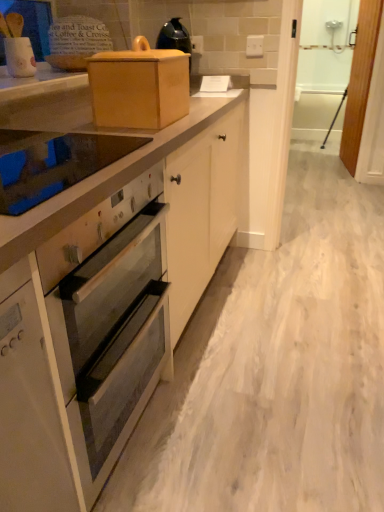
What is the approximate height of glass smooth cooktop at upper left?

glass smooth cooktop at upper left is 1.31 inches in height.

This screenshot has height=512, width=384. In order to click on wooden box at upper center in this screenshot , I will do `click(139, 87)`.

Could you tell me if wooden box at upper center is facing white glossy oven at center?

No, wooden box at upper center is not turned towards white glossy oven at center.

Which object is more forward, wooden box at upper center or white glossy oven at center?

Positioned in front is white glossy oven at center.

Is wooden box at upper center far from white glossy oven at center?

wooden box at upper center is near white glossy oven at center, not far away.

How far apart are wooden box at upper center and white wood screen door at right, marked as the 2th screen door in a right-to-left arrangement?

wooden box at upper center is 4.26 meters from white wood screen door at right, marked as the 2th screen door in a right-to-left arrangement.

Which of these two, wooden box at upper center or white wood screen door at right, which ranks as the 1th screen door in left-to-right order, is smaller?

Smaller between the two is wooden box at upper center.

Is wooden box at upper center positioned with its back to white wood screen door at right, which ranks as the 1th screen door in left-to-right order?

Result: No.

Is point (139, 76) closer to camera compared to point (326, 14)?

Yes, it is.

Considering the points (349, 91) and (100, 92), which point is behind, point (349, 91) or point (100, 92)?

Positioned behind is point (349, 91).

Is wooden box at upper center at the back of wooden screen door at right, the first screen door viewed from the right?

No, wooden screen door at right, the first screen door viewed from the right, is not facing away from wooden box at upper center.

Which of these two, wooden screen door at right, the first screen door viewed from the right, or wooden box at upper center, is wider?

Wider between the two is wooden box at upper center.

Is wooden screen door at right, marked as the second screen door in a left-to-right arrangement, inside or outside of white wood screen door at right, which ranks as the 1th screen door in left-to-right order?

wooden screen door at right, marked as the second screen door in a left-to-right arrangement, lies outside white wood screen door at right, which ranks as the 1th screen door in left-to-right order.

From the image's perspective, is wooden screen door at right, marked as the second screen door in a left-to-right arrangement, above or below white wood screen door at right, which ranks as the 1th screen door in left-to-right order?

wooden screen door at right, marked as the second screen door in a left-to-right arrangement, is situated higher than white wood screen door at right, which ranks as the 1th screen door in left-to-right order, in the image.

Based on the photo, does wooden screen door at right, marked as the second screen door in a left-to-right arrangement, lie in front of white wood screen door at right, marked as the 2th screen door in a right-to-left arrangement?

No, wooden screen door at right, marked as the second screen door in a left-to-right arrangement, is behind white wood screen door at right, marked as the 2th screen door in a right-to-left arrangement.

From a real-world perspective, does white wood screen door at right, marked as the 2th screen door in a right-to-left arrangement, sit lower than white glossy oven at center?

No.

Is white wood screen door at right, which ranks as the 1th screen door in left-to-right order, positioned far away from white glossy oven at center?

Yes.

Considering the positions of points (308, 67) and (121, 437), is point (308, 67) farther from camera compared to point (121, 437)?

That is True.

Does white wood screen door at right, which ranks as the 1th screen door in left-to-right order, turn towards white glossy oven at center?

Yes.

From the image's perspective, is wooden screen door at right, marked as the second screen door in a left-to-right arrangement, beneath glass smooth cooktop at upper left?

No, from the image's perspective, wooden screen door at right, marked as the second screen door in a left-to-right arrangement, is not beneath glass smooth cooktop at upper left.

Does point (348, 163) come closer to viewer compared to point (47, 147)?

No, it is not.

From a real-world perspective, who is located lower, wooden screen door at right, the first screen door viewed from the right, or glass smooth cooktop at upper left?

wooden screen door at right, the first screen door viewed from the right, is physically lower.

Which is closer to the camera, (156,100) or (18,154)?

Positioned in front is point (18,154).

Is wooden box at upper center beside glass smooth cooktop at upper left?

No, wooden box at upper center is not touching glass smooth cooktop at upper left.

Between wooden box at upper center and glass smooth cooktop at upper left, which one appears on the right side from the viewer's perspective?

Positioned to the right is wooden box at upper center.

Which is correct: wooden box at upper center is inside glass smooth cooktop at upper left, or outside of it?

wooden box at upper center lies outside glass smooth cooktop at upper left.

At what (x,y) coordinates should I click in order to perform the action: click on appliance that appears above the white glossy oven at center (from a real-world perspective). Please return your answer as a coordinate pair (x, y). Looking at the image, I should click on (139, 87).

From the image's perspective, count 1st screen doors upward from the wooden box at upper center and point to it. Please provide its 2D coordinates.

[(322, 64)]

From the image, which object appears to be nearer to glass smooth cooktop at upper left, wooden screen door at right, the first screen door viewed from the right, or white glossy oven at center?

white glossy oven at center lies closer to glass smooth cooktop at upper left than the other object.

Looking at the image, which one is located further to white glossy oven at center, white wood screen door at right, which ranks as the 1th screen door in left-to-right order, or wooden box at upper center?

white wood screen door at right, which ranks as the 1th screen door in left-to-right order, lies further to white glossy oven at center than the other object.

Which object lies nearer to the anchor point white wood screen door at right, marked as the 2th screen door in a right-to-left arrangement, wooden box at upper center or white glossy oven at center?

The object closer to white wood screen door at right, marked as the 2th screen door in a right-to-left arrangement, is wooden box at upper center.

When comparing their distances from glass smooth cooktop at upper left, does white wood screen door at right, marked as the 2th screen door in a right-to-left arrangement, or white glossy oven at center seem closer?

white glossy oven at center is positioned closer to the anchor glass smooth cooktop at upper left.

Which object lies nearer to the anchor point white wood screen door at right, marked as the 2th screen door in a right-to-left arrangement, wooden screen door at right, marked as the second screen door in a left-to-right arrangement, or wooden box at upper center?

wooden screen door at right, marked as the second screen door in a left-to-right arrangement, is closer to white wood screen door at right, marked as the 2th screen door in a right-to-left arrangement.

Estimate the real-world distances between objects in this image. Which object is closer to wooden screen door at right, the first screen door viewed from the right, wooden box at upper center or white wood screen door at right, marked as the 2th screen door in a right-to-left arrangement?

Among the two, white wood screen door at right, marked as the 2th screen door in a right-to-left arrangement, is located nearer to wooden screen door at right, the first screen door viewed from the right.

Looking at this image, which object lies further to the anchor point white wood screen door at right, marked as the 2th screen door in a right-to-left arrangement, wooden box at upper center or glass smooth cooktop at upper left?

glass smooth cooktop at upper left is positioned further to the anchor white wood screen door at right, marked as the 2th screen door in a right-to-left arrangement.

In the scene shown: Based on their spatial positions, is white glossy oven at center or wooden box at upper center closer to wooden screen door at right, the first screen door viewed from the right?

Among the two, wooden box at upper center is located nearer to wooden screen door at right, the first screen door viewed from the right.

Find the location of a particular element. This screenshot has width=384, height=512. appliance located between white glossy oven at center and white wood screen door at right, which ranks as the 1th screen door in left-to-right order, in the depth direction is located at coordinates (139, 87).

Where is `appliance positioned between glass smooth cooktop at upper left and white wood screen door at right, which ranks as the 1th screen door in left-to-right order, from near to far`? Image resolution: width=384 pixels, height=512 pixels. appliance positioned between glass smooth cooktop at upper left and white wood screen door at right, which ranks as the 1th screen door in left-to-right order, from near to far is located at coordinates (139, 87).

The image size is (384, 512). I want to click on home appliance between white glossy oven at center and wooden screen door at right, the first screen door viewed from the right, from front to back, so click(57, 166).

Image resolution: width=384 pixels, height=512 pixels. What are the coordinates of `screen door between wooden box at upper center and wooden screen door at right, marked as the second screen door in a left-to-right arrangement, along the z-axis` in the screenshot? It's located at pos(322,64).